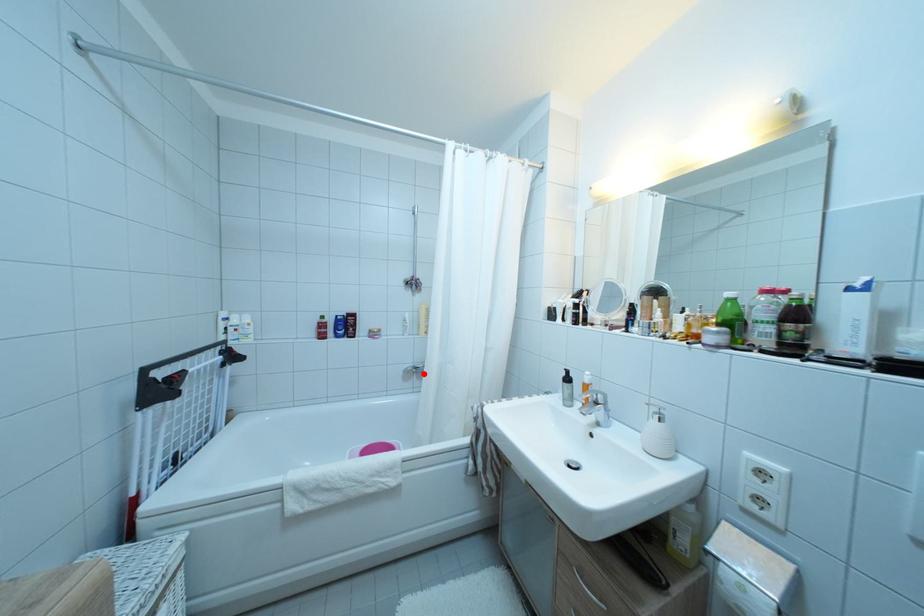
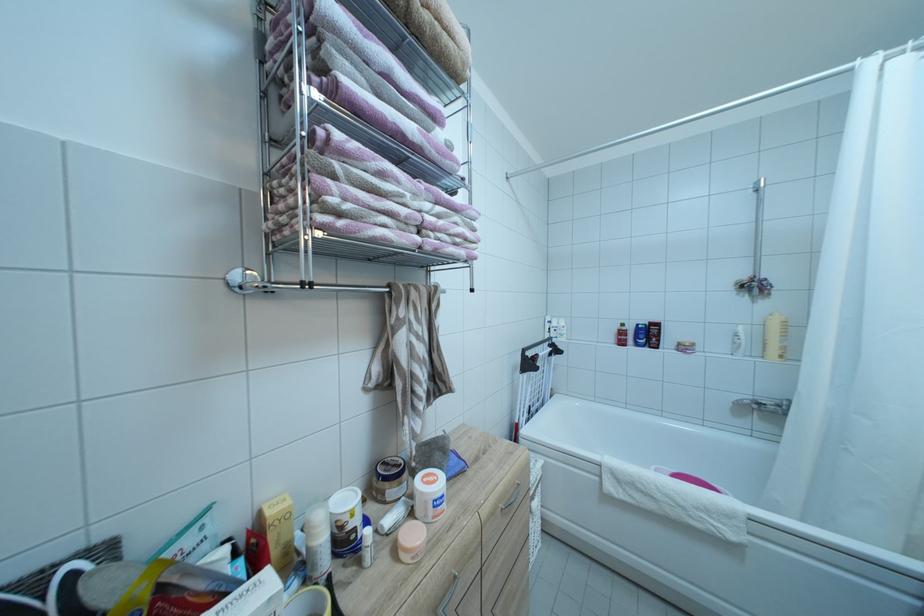
The point at the highlighted location is marked in the first image. Where is the corresponding point in the second image?

(767, 410)